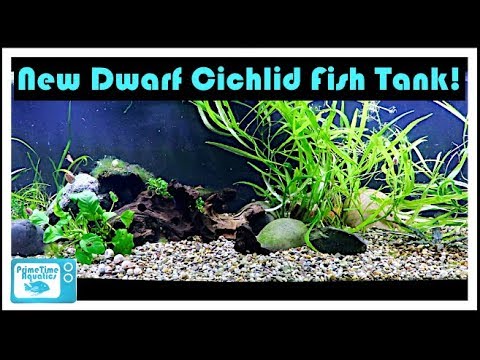
This screenshot has height=360, width=480. In order to click on glass in this screenshot , I will do `click(158, 161)`, `click(105, 128)`, `click(427, 113)`.